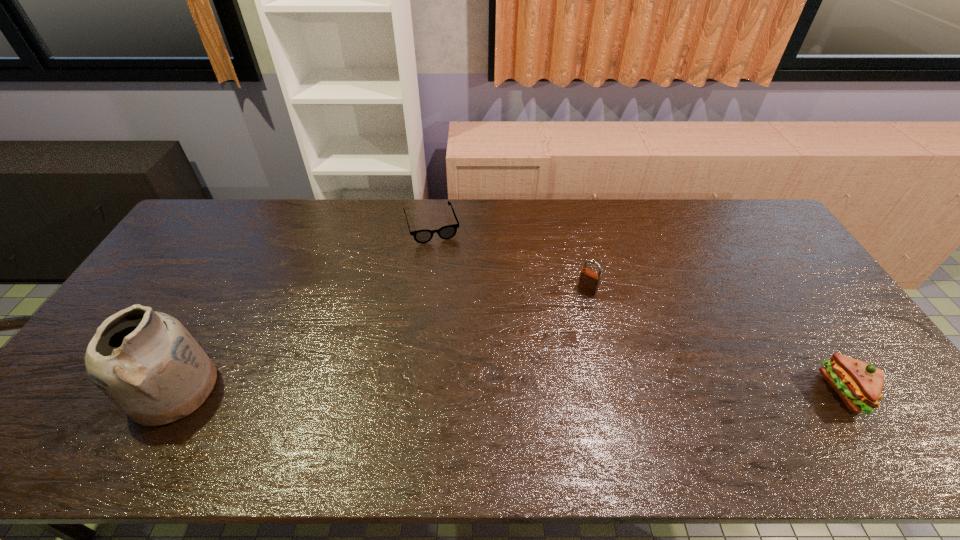
What are the coordinates of `free space located 0.210m on the arms of the farthest object` in the screenshot? It's located at (451, 288).

The image size is (960, 540). I want to click on vacant space located on the arms of the farthest object, so click(442, 258).

You are a GUI agent. You are given a task and a screenshot of the screen. Output one action in this format:
    pyautogui.click(x=<x>, y=<y>)
    Task: Click on the vacant space located 0.300m on the front-facing side of the second object from right to left
    The height and width of the screenshot is (540, 960).
    Given the screenshot: What is the action you would take?
    pyautogui.click(x=529, y=361)

Locate an element on the screen. This screenshot has height=540, width=960. blank space located 0.220m on the front-facing side of the second object from right to left is located at coordinates (545, 341).

Where is `vacant space situated on the front-facing side of the second object from right to left`? Image resolution: width=960 pixels, height=540 pixels. vacant space situated on the front-facing side of the second object from right to left is located at coordinates (513, 382).

This screenshot has width=960, height=540. Identify the location of object that is at the far edge. (446, 232).

Find the location of `pottery present at the near edge`. pottery present at the near edge is located at coordinates (147, 363).

The width and height of the screenshot is (960, 540). What are the coordinates of `sandwich that is at the near edge` in the screenshot? It's located at (859, 384).

Locate an element on the screen. object at the left edge is located at coordinates (147, 363).

Locate an element on the screen. The width and height of the screenshot is (960, 540). object that is at the right edge is located at coordinates (859, 384).